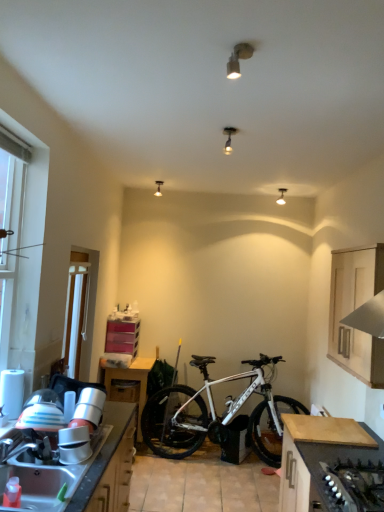
Question: Considering the relative positions of light wood cabinet at upper right, placed as the first cabinetry when sorted from top to bottom, and metallic stainless steel sink at lower left in the image provided, is light wood cabinet at upper right, placed as the first cabinetry when sorted from top to bottom, to the left of metallic stainless steel sink at lower left from the viewer's perspective?

Choices:
 (A) no
 (B) yes

Answer: (A)

Question: Are light wood cabinet at upper right, marked as the second cabinetry in a bottom-to-top arrangement, and metallic stainless steel sink at lower left far apart?

Choices:
 (A) no
 (B) yes

Answer: (B)

Question: Does light wood cabinet at upper right, placed as the first cabinetry when sorted from top to bottom, touch metallic stainless steel sink at lower left?

Choices:
 (A) no
 (B) yes

Answer: (A)

Question: Is light wood cabinet at upper right, marked as the second cabinetry in a bottom-to-top arrangement, at the right side of metallic stainless steel sink at lower left?

Choices:
 (A) yes
 (B) no

Answer: (A)

Question: Is metallic stainless steel sink at lower left inside light wood cabinet at upper right, marked as the second cabinetry in a bottom-to-top arrangement?

Choices:
 (A) no
 (B) yes

Answer: (A)

Question: From the image's perspective, is light wood cabinet at upper right, placed as the first cabinetry when sorted from top to bottom, on metallic stainless steel sink at lower left?

Choices:
 (A) yes
 (B) no

Answer: (A)

Question: Can you confirm if matte black light fixture at center, placed as the third lamp when sorted from left to right, is taller than wooden drawer at lower left?

Choices:
 (A) yes
 (B) no

Answer: (B)

Question: Is matte black light fixture at center, which appears as the second lamp when viewed from the front, smaller than wooden drawer at lower left?

Choices:
 (A) yes
 (B) no

Answer: (A)

Question: From a real-world perspective, is matte black light fixture at center, which appears as the second lamp when viewed from the front, located higher than wooden drawer at lower left?

Choices:
 (A) yes
 (B) no

Answer: (A)

Question: Is matte black light fixture at center, placed as the third lamp when sorted from left to right, beside wooden drawer at lower left?

Choices:
 (A) no
 (B) yes

Answer: (A)

Question: Could you tell me if matte black light fixture at center, which appears as the 3th lamp when viewed from the back, is facing wooden drawer at lower left?

Choices:
 (A) no
 (B) yes

Answer: (A)

Question: Is matte black light fixture at center, placed as the third lamp when sorted from left to right, thinner than wooden drawer at lower left?

Choices:
 (A) no
 (B) yes

Answer: (B)

Question: From the image's perspective, is wooden drawer at lower left on top of metallic stainless steel sink at lower left?

Choices:
 (A) no
 (B) yes

Answer: (A)